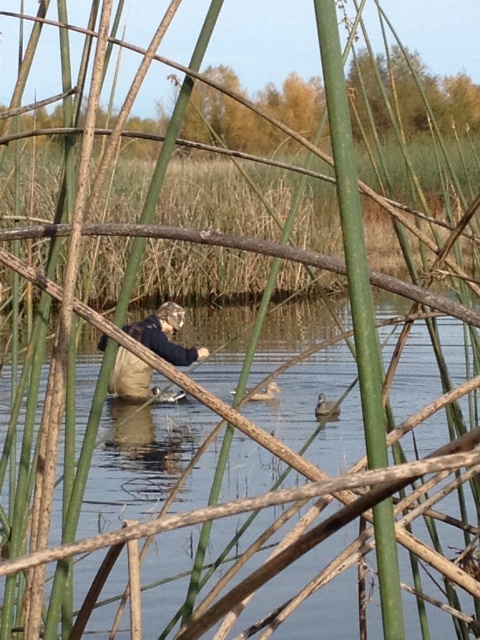
Question: Does clear water at center have a larger size compared to white matte duck at center?

Choices:
 (A) yes
 (B) no

Answer: (A)

Question: Which point is closer to the camera?

Choices:
 (A) white matte duck at center
 (B) dark blue fabric at center
 (C) clear water at center

Answer: (C)

Question: Is clear water at center further to camera compared to dark blue fabric at center?

Choices:
 (A) yes
 (B) no

Answer: (B)

Question: Is clear water at center to the right of dark blue fabric at center from the viewer's perspective?

Choices:
 (A) no
 (B) yes

Answer: (B)

Question: Which of these objects is positioned closest to the dark blue fabric at center?

Choices:
 (A) white matte duck at center
 (B) brown fuzzy duck at center

Answer: (B)

Question: Based on their relative distances, which object is nearer to the brown fuzzy duck at center?

Choices:
 (A) clear water at center
 (B) white matte duck at center
 (C) dark blue fabric at center

Answer: (B)